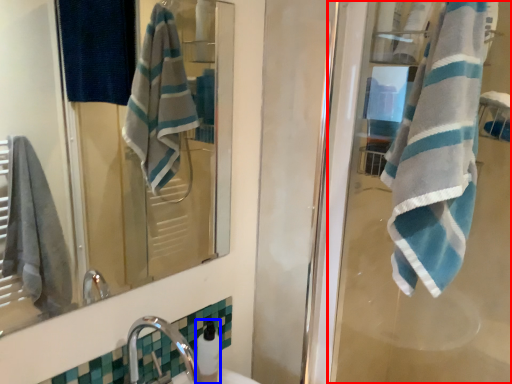
Question: Among these objects, which one is farthest to the camera, screen door (highlighted by a red box) or soap dispenser (highlighted by a blue box)?

Choices:
 (A) screen door
 (B) soap dispenser

Answer: (B)